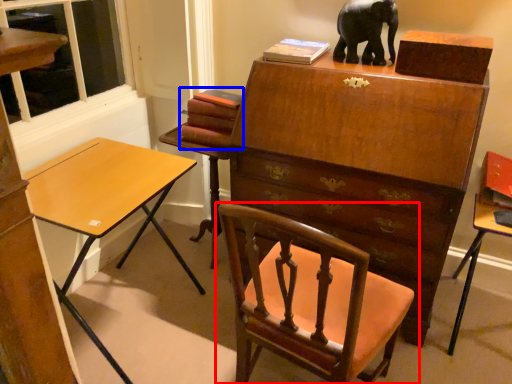
Question: Which object is further to the camera taking this photo, chair (highlighted by a red box) or book (highlighted by a blue box)?

Choices:
 (A) chair
 (B) book

Answer: (B)